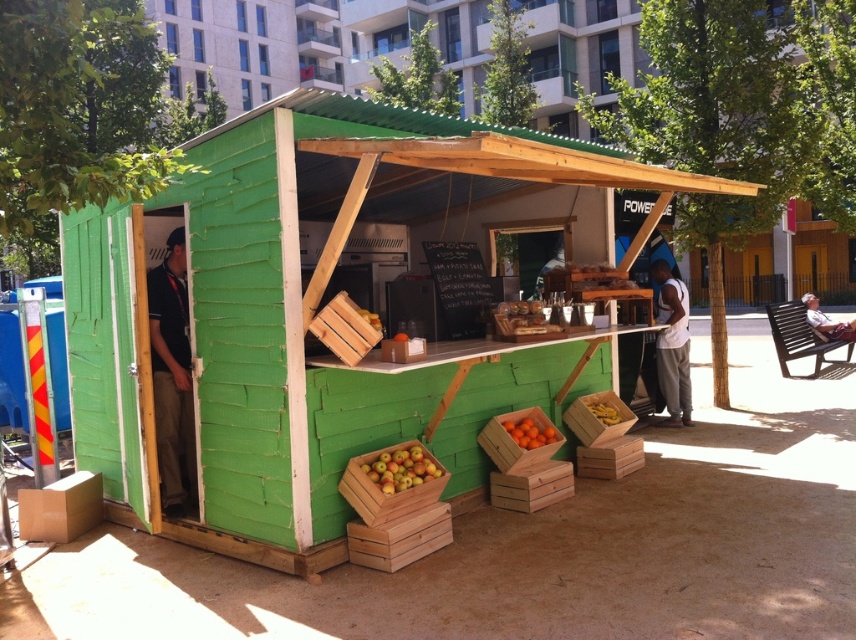
Looking at this image, you are a customer at the food stall and want to grab the orange matte wooden crate at lower center to see its contents. However, there is a white cotton tank top at right in the way. Based on their positions, can you easily reach the crate without moving the tank top?

The white cotton tank top at right is on the right side of the orange matte wooden crate at lower center. Since the tank top is to the right of the crate, you can still reach the crate by moving around to its left side, so you don

You are a customer standing in front of the food stall. You want to know where the black shirt at left is located. Can you describe its position relative to the counter?

The black shirt at left is located at point 0.589 on the x axis and 0.202 on the y axis relative to the counter.

You are a customer at the food stall and want to buy the red matte apples at lower left. The vendor tells you that the white cotton tank top at right is not for sale. Which item should you point to when asking for the apples?

You should point to the red matte apples at lower left, as the white cotton tank top at right is not for sale.